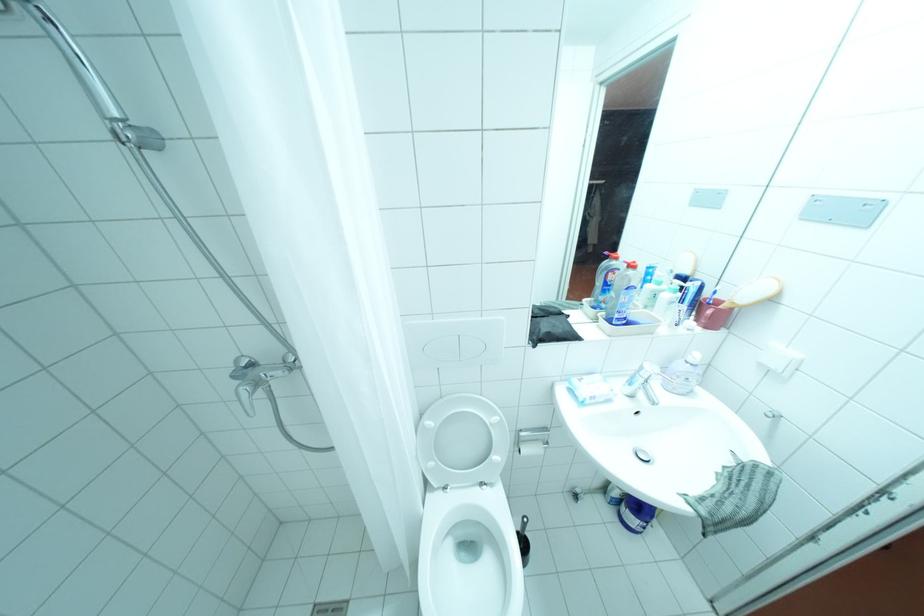
Find where to lower the white toilet lid. Please return your answer as a coordinate pair (x, y).

(464, 451)